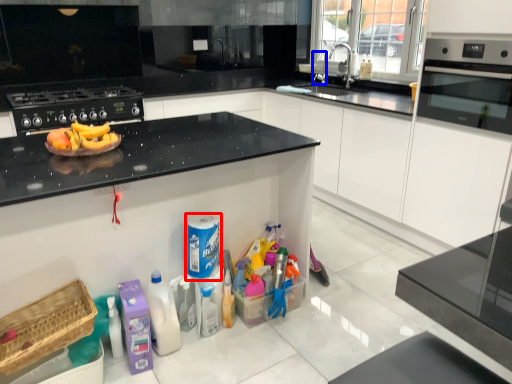
Question: Which of the following is the farthest to the observer, cleaning product (highlighted by a red box) or faucet (highlighted by a blue box)?

Choices:
 (A) cleaning product
 (B) faucet

Answer: (B)